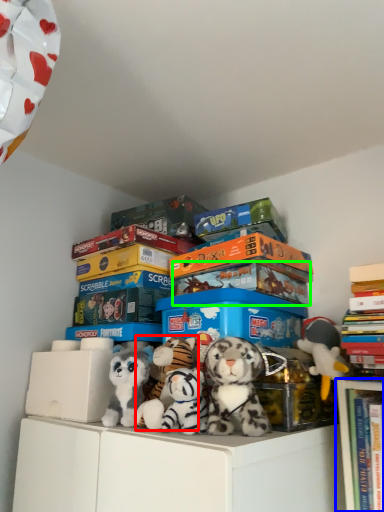
Question: Which is farther away from toy (highlighted by a red box)? bookcase (highlighted by a blue box) or storage box (highlighted by a green box)?

Choices:
 (A) bookcase
 (B) storage box

Answer: (A)